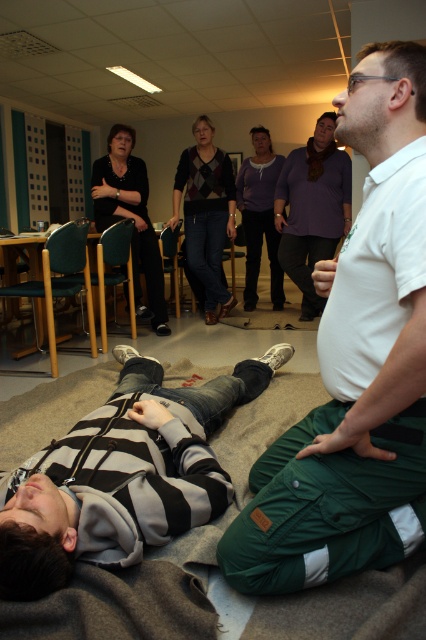
Who is lower down, white cotton shirt at upper right or black matte shirt at upper left?

Positioned lower is white cotton shirt at upper right.

Can you confirm if white cotton shirt at upper right is smaller than black matte shirt at upper left?

Yes, white cotton shirt at upper right is smaller than black matte shirt at upper left.

Describe the element at coordinates (356, 365) in the screenshot. This screenshot has width=426, height=640. I see `white cotton shirt at upper right` at that location.

The width and height of the screenshot is (426, 640). Find the location of `white cotton shirt at upper right`. white cotton shirt at upper right is located at coordinates (356, 365).

Between argyle sweater at center and black matte shirt at upper left, which one is positioned higher?

argyle sweater at center is above.

Is argyle sweater at center wider than black matte shirt at upper left?

Indeed, argyle sweater at center has a greater width compared to black matte shirt at upper left.

The height and width of the screenshot is (640, 426). What are the coordinates of `argyle sweater at center` in the screenshot? It's located at (206, 212).

Looking at this image, which of these two, white cotton shirt at upper right or argyle sweater at center, stands taller?

With more height is argyle sweater at center.

Is white cotton shirt at upper right thinner than argyle sweater at center?

Yes.

This screenshot has height=640, width=426. I want to click on white cotton shirt at upper right, so click(356, 365).

The image size is (426, 640). What are the coordinates of `white cotton shirt at upper right` in the screenshot? It's located at (356, 365).